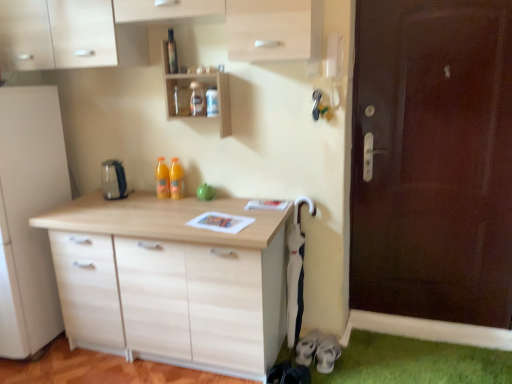
Question: Does satin silver kettle at center appear on the left side of wooden shelf at upper center?

Choices:
 (A) yes
 (B) no

Answer: (A)

Question: Can you confirm if satin silver kettle at center is wider than wooden shelf at upper center?

Choices:
 (A) no
 (B) yes

Answer: (B)

Question: Can you confirm if satin silver kettle at center is thinner than wooden shelf at upper center?

Choices:
 (A) no
 (B) yes

Answer: (A)

Question: Is satin silver kettle at center looking in the opposite direction of wooden shelf at upper center?

Choices:
 (A) no
 (B) yes

Answer: (A)

Question: From a real-world perspective, is satin silver kettle at center positioned over wooden shelf at upper center based on gravity?

Choices:
 (A) no
 (B) yes

Answer: (A)

Question: Does satin silver kettle at center have a greater height compared to wooden shelf at upper center?

Choices:
 (A) yes
 (B) no

Answer: (B)

Question: From a real-world perspective, is transparent glass bottle at upper center, positioned as the 1th bottle in front-to-back order, positioned over orange translucent bottle at center, marked as the 1th bottle in a bottom-to-top arrangement, based on gravity?

Choices:
 (A) no
 (B) yes

Answer: (B)

Question: Is transparent glass bottle at upper center, acting as the 2th bottle starting from the bottom, behind orange translucent bottle at center, the 2th bottle when ordered from right to left?

Choices:
 (A) no
 (B) yes

Answer: (A)

Question: Does transparent glass bottle at upper center, arranged as the first bottle when viewed from the right, contain orange translucent bottle at center, the 2th bottle when ordered from right to left?

Choices:
 (A) yes
 (B) no

Answer: (B)

Question: Is transparent glass bottle at upper center, arranged as the first bottle when viewed from the right, completely or partially outside of orange translucent bottle at center, the 2th bottle when ordered from front to back?

Choices:
 (A) no
 (B) yes

Answer: (B)

Question: Is transparent glass bottle at upper center, arranged as the first bottle when viewed from the right, taller than orange translucent bottle at center, the 2th bottle when ordered from right to left?

Choices:
 (A) no
 (B) yes

Answer: (B)

Question: Does transparent glass bottle at upper center, arranged as the first bottle when viewed from the right, have a lesser height compared to orange translucent bottle at center, which is the second bottle in top-to-bottom order?

Choices:
 (A) no
 (B) yes

Answer: (A)

Question: Is wooden shelf at upper center bigger than transparent glass bottle at upper center, which ranks as the 1th bottle in top-to-bottom order?

Choices:
 (A) yes
 (B) no

Answer: (A)